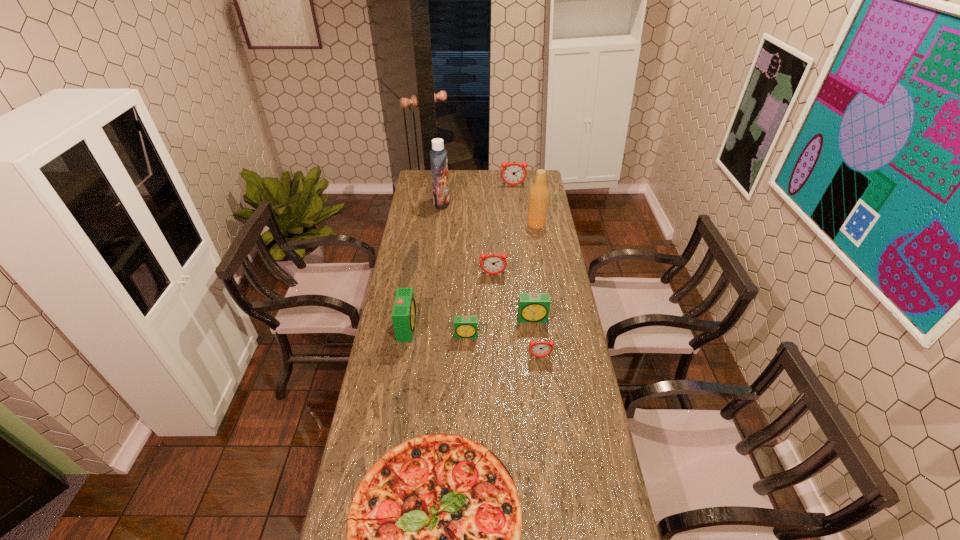
The image size is (960, 540). I want to click on blank space located on the front-facing side of the second smallest green alarm clock, so coord(536,341).

Locate an element on the screen. The image size is (960, 540). vacant area situated 0.350m on the front-facing side of the second nearest object is located at coordinates (552, 453).

The height and width of the screenshot is (540, 960). What are the coordinates of `blank space located 0.370m on the front-facing side of the smallest green alarm clock` in the screenshot? It's located at (464, 430).

You are a GUI agent. You are given a task and a screenshot of the screen. Output one action in this format:
    pyautogui.click(x=<x>, y=<y>)
    Task: Click on the object at the far edge
    The image size is (960, 540).
    Given the screenshot: What is the action you would take?
    pyautogui.click(x=513, y=173)

The image size is (960, 540). I want to click on shampoo situated at the left edge, so click(x=438, y=155).

Identify the location of alarm clock located at the left edge. This screenshot has width=960, height=540. (404, 314).

At what (x,y) coordinates should I click in order to perform the action: click on beer bottle positioned at the right edge. Please return your answer as a coordinate pair (x, y). Looking at the image, I should click on (539, 193).

Locate an element on the screen. object that is at the far right corner is located at coordinates (513, 173).

Locate an element on the screen. The image size is (960, 540). free space at the far edge of the desktop is located at coordinates 467,170.

In the image, there is a desktop. Identify the location of free space at the left edge. This screenshot has width=960, height=540. (411, 364).